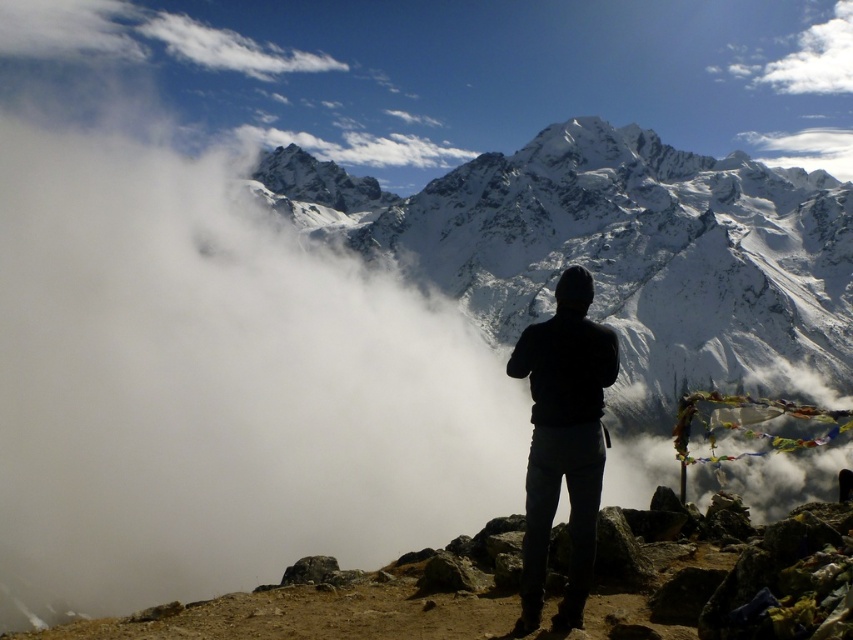
Question: Can you confirm if black matte jacket at center is smaller than white fluffy cloud at upper right?

Choices:
 (A) yes
 (B) no

Answer: (B)

Question: Which point appears farthest from the camera in this image?

Choices:
 (A) (808, 173)
 (B) (595, 374)
 (C) (141, 26)

Answer: (C)

Question: Does white fluffy cloud at upper center lie in front of white fluffy cloud at upper right?

Choices:
 (A) no
 (B) yes

Answer: (A)

Question: Which of these objects is positioned farthest from the snowy granite mountain at upper center?

Choices:
 (A) white fluffy cloud at upper center
 (B) white fluffy cloud at upper right

Answer: (A)

Question: Does snowy granite mountain at upper center have a smaller size compared to white fluffy cloud at upper center?

Choices:
 (A) yes
 (B) no

Answer: (B)

Question: Which object appears farthest from the camera in this image?

Choices:
 (A) white fluffy cloud at upper right
 (B) black matte jacket at center
 (C) white fluffy cloud at upper center

Answer: (C)